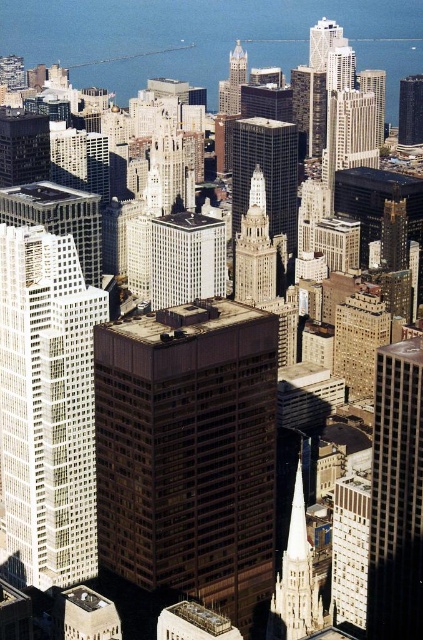
You are a drone operator trying to navigate between two points in the urban skyline. You see the point at coordinates point (x=74, y=372) and the point at coordinates point (x=390, y=522). Which point is closer to your current position?

Point (x=74, y=372) is closer to the viewer than point (x=390, y=522), so the point at coordinates point (x=74, y=372) is closer to your current position.

You are a drone operator tasked with delivering a package to a white glass building at left. The delivery zone is marked by a point at coordinates (47, 406). Can you confirm if the white glass building at left is located at those coordinates?

Yes, the point at coordinates (47, 406) marks the white glass building at left, so the delivery zone is correctly located there.